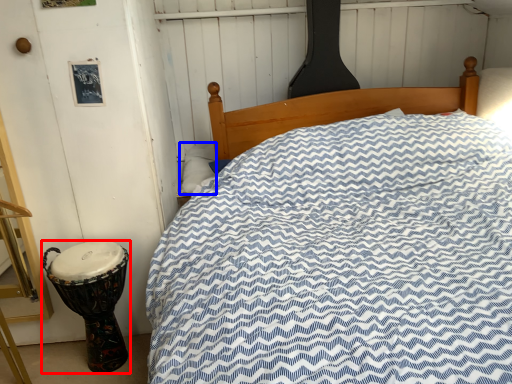
Question: Which object is further to the camera taking this photo, drum (highlighted by a red box) or pillow (highlighted by a blue box)?

Choices:
 (A) drum
 (B) pillow

Answer: (B)